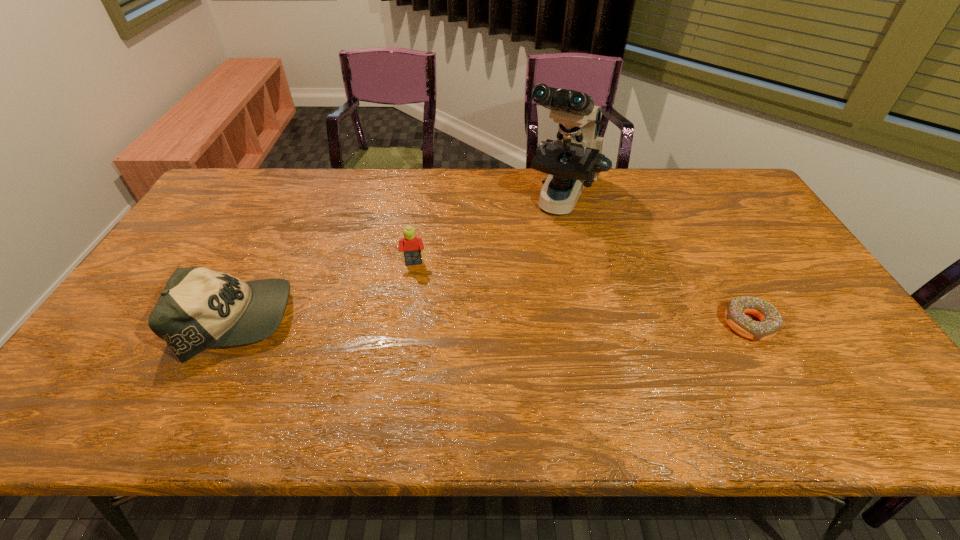
The height and width of the screenshot is (540, 960). What are the coordinates of `vacant space on the desktop that is between the baseball cap and the shortest object and is positioned through the eyepieces of the second object from right to left` in the screenshot? It's located at (496, 322).

In order to click on vacant space on the desktop that is between the baseball cap and the shortest object and is positioned on the face of the third nearest object in this screenshot , I will do `click(417, 322)`.